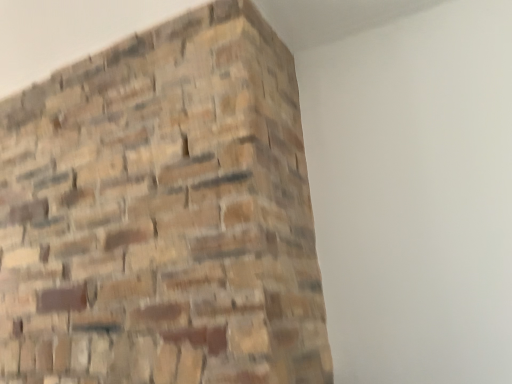
Measure the distance between point (218, 46) and camera.

Point (218, 46) and camera are 4.52 feet apart.

What is the approximate width of natural stone brickwork at upper left?

natural stone brickwork at upper left is 33.19 inches in width.

The image size is (512, 384). Describe the element at coordinates (162, 214) in the screenshot. I see `natural stone brickwork at upper left` at that location.

Measure the distance between natural stone brickwork at upper left and camera.

1.04 meters.

Identify the location of natural stone brickwork at upper left. (162, 214).

The image size is (512, 384). Identify the location of natural stone brickwork at upper left. (162, 214).